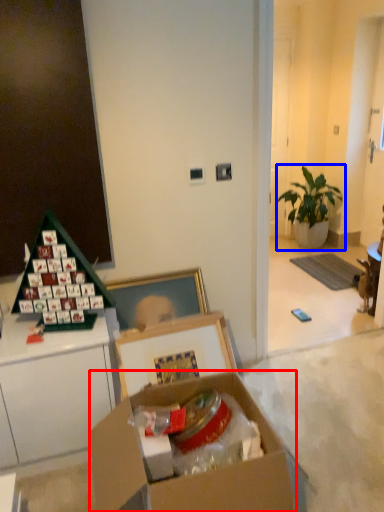
Question: Which object appears farthest to the camera in this image, box (highlighted by a red box) or houseplant (highlighted by a blue box)?

Choices:
 (A) box
 (B) houseplant

Answer: (B)